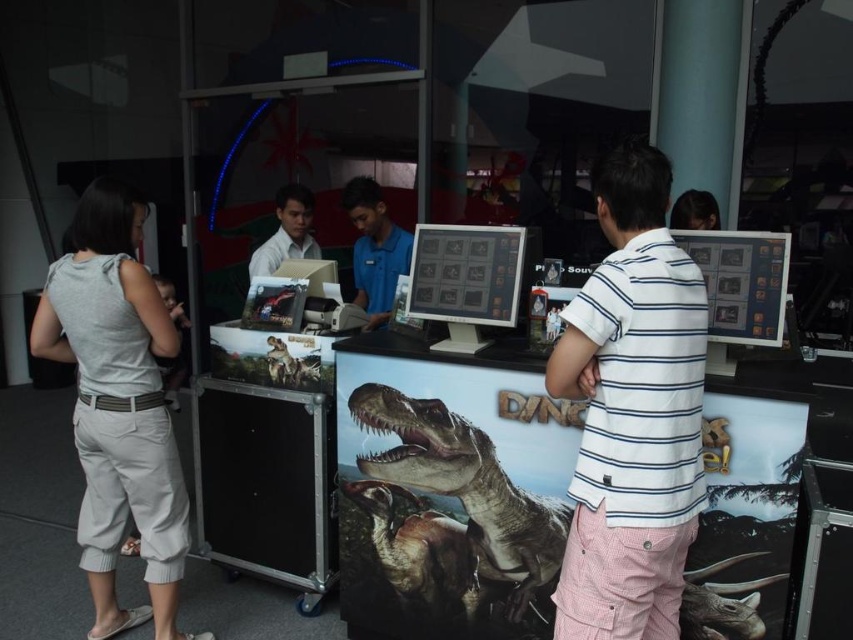
Question: Among these objects, which one is nearest to the camera?

Choices:
 (A) matte white shirt at center
 (B) blue shirt at center
 (C) white striped shirt at right
 (D) shiny metallic dinosaur at center

Answer: (C)

Question: Does white striped shirt at right have a smaller size compared to matte white shirt at center?

Choices:
 (A) no
 (B) yes

Answer: (A)

Question: Which point appears closest to the camera in this image?

Choices:
 (A) (306, 216)
 (B) (537, 538)
 (C) (599, 298)
 (D) (399, 250)

Answer: (C)

Question: Considering the relative positions of white striped shirt at right and blue shirt at center in the image provided, where is white striped shirt at right located with respect to blue shirt at center?

Choices:
 (A) above
 (B) below

Answer: (B)

Question: Among these objects, which one is farthest from the camera?

Choices:
 (A) blue shirt at center
 (B) gray cotton pants at left

Answer: (A)

Question: Is white striped shirt at right above shiny metallic dinosaur at center?

Choices:
 (A) no
 (B) yes

Answer: (B)